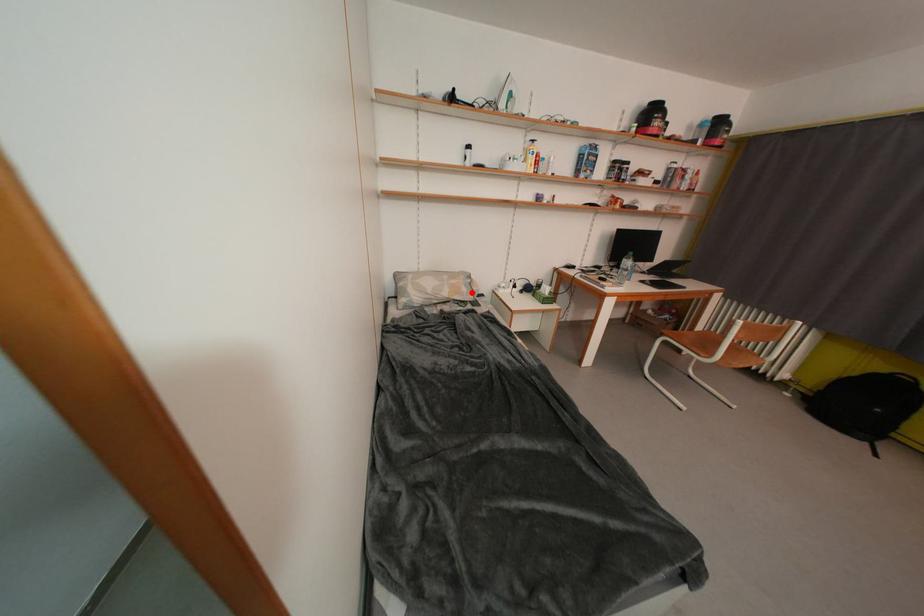
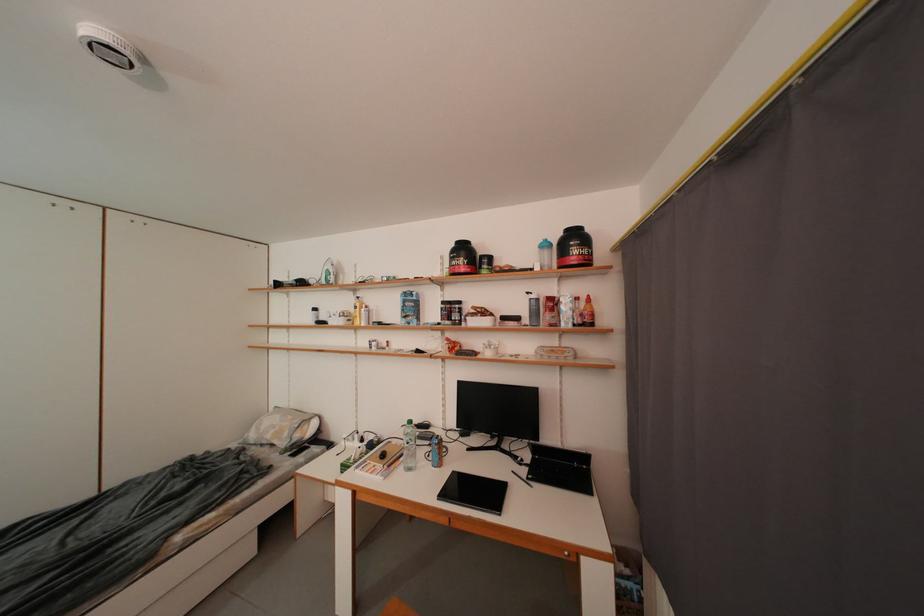
Question: I am providing you with two images of the same scene from different viewpoints. A red point is marked on the first image. At the location where the point appears in image 1, is it still visible in image 2?

Choices:
 (A) Yes
 (B) No

Answer: (A)